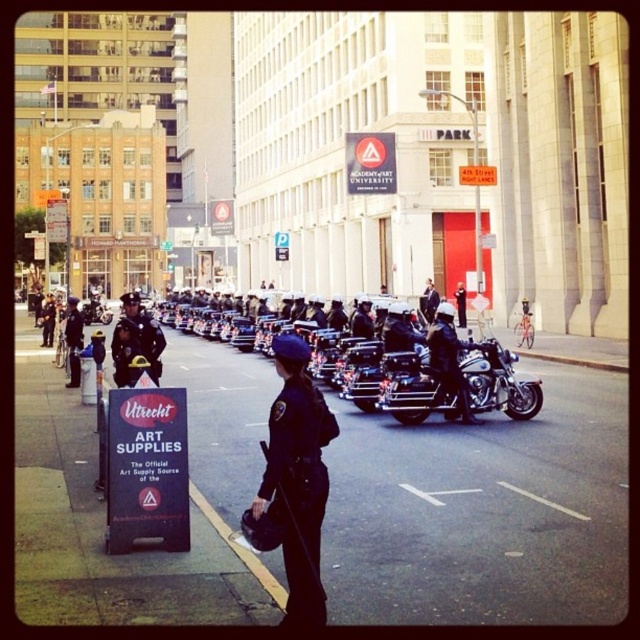
Looking at this image, who is positioned more to the left, shiny black helmet at center or white painted line at center?

From the viewer's perspective, shiny black helmet at center appears more on the left side.

Does shiny black helmet at center have a lesser height compared to white painted line at center?

No, shiny black helmet at center is not shorter than white painted line at center.

This screenshot has height=640, width=640. I want to click on shiny black helmet at center, so click(134, 339).

Where is `shiny black helmet at center`? The width and height of the screenshot is (640, 640). shiny black helmet at center is located at coordinates (134, 339).

In order to click on dark blue uniform at center in this screenshot , I will do `click(294, 483)`.

Who is more forward, (321, 618) or (396, 365)?

Positioned in front is point (321, 618).

Identify the location of dark blue uniform at center. (294, 483).

Does shiny chrome motorcycle at center have a smaller size compared to white painted line at center?

No, shiny chrome motorcycle at center is not smaller than white painted line at center.

The width and height of the screenshot is (640, 640). What are the coordinates of `shiny chrome motorcycle at center` in the screenshot? It's located at (497, 381).